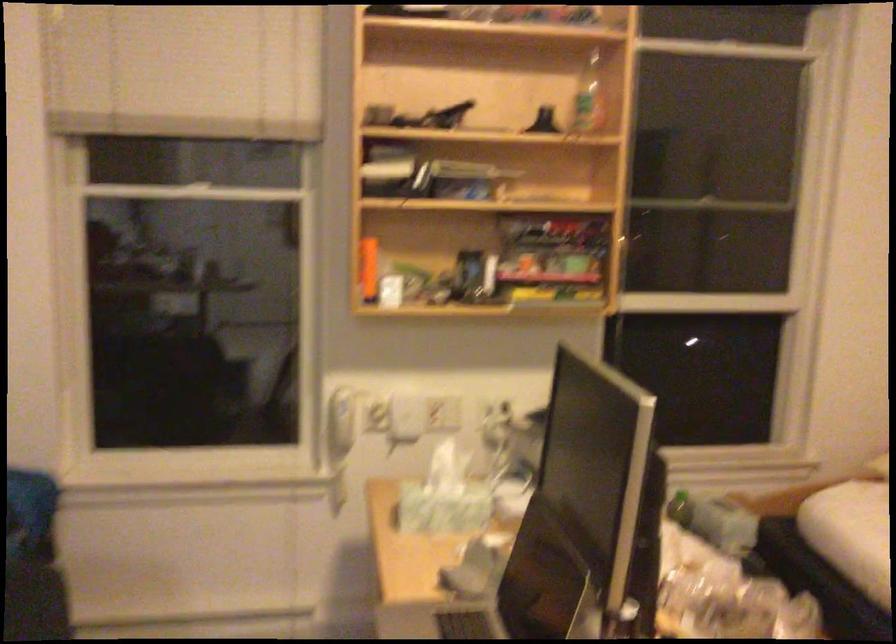
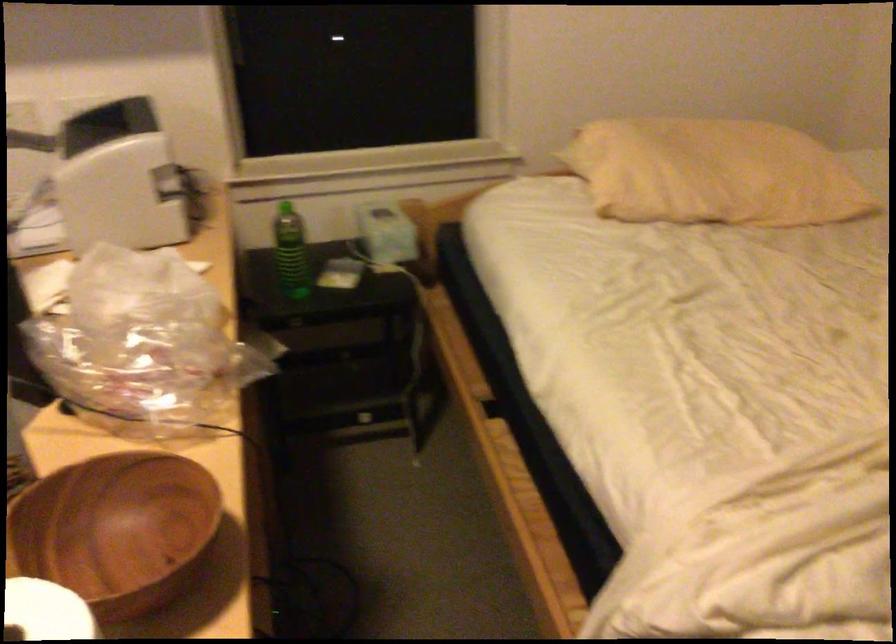
The images are taken continuously from a first-person perspective. In which direction are you moving?

The movement direction of the cameraman is right, forward.